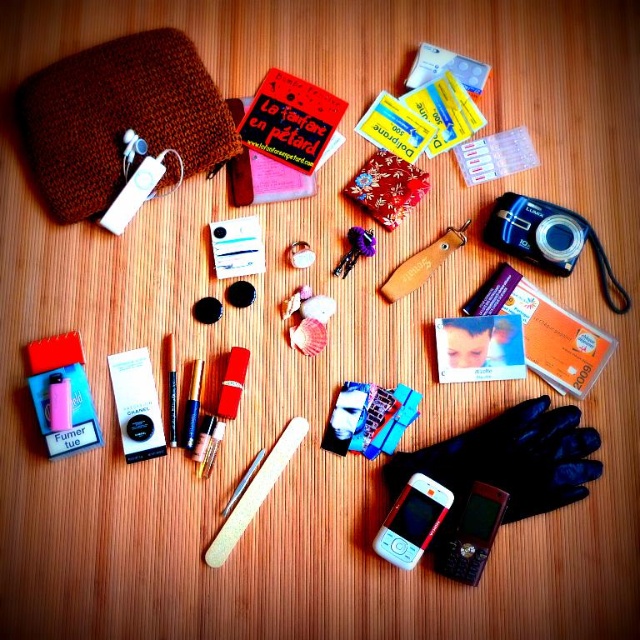
You are looking at the items on the wooden surface. There are two points marked on the image. Which point, point [472,547] or point [397,296], is closer to you?

Point [472,547] is closer to the viewer than point [397,296].

You are organizing items on a table and need to place the matte white phone at bottom center and the wooden nail file at center. Which object is shorter in height?

The matte white phone at bottom center is shorter in height than the wooden nail file at center.